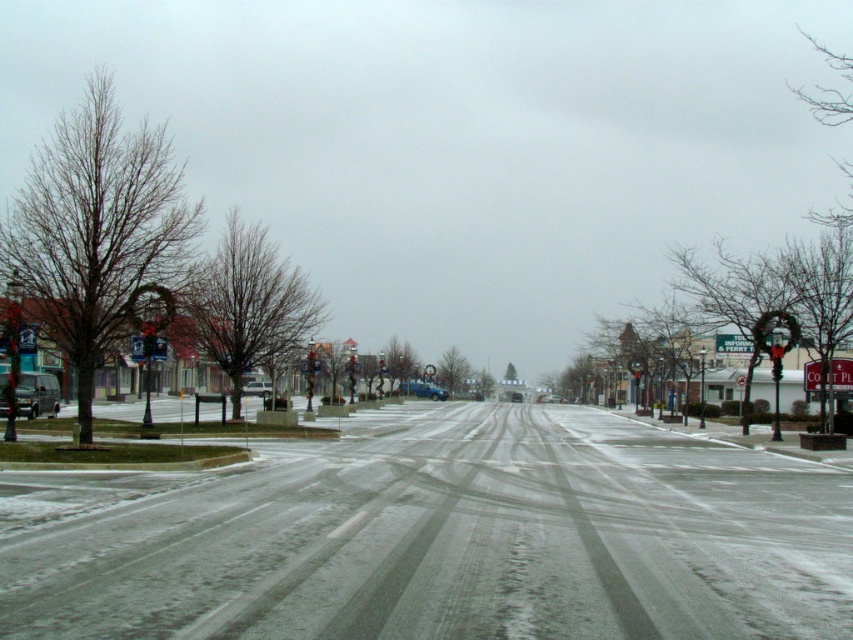
I want to click on white powdery snow at center, so click(x=444, y=538).

In the scene shown: Is white powdery snow at center positioned behind shiny black van at left?

No, it is in front of shiny black van at left.

This screenshot has height=640, width=853. I want to click on white powdery snow at center, so click(x=444, y=538).